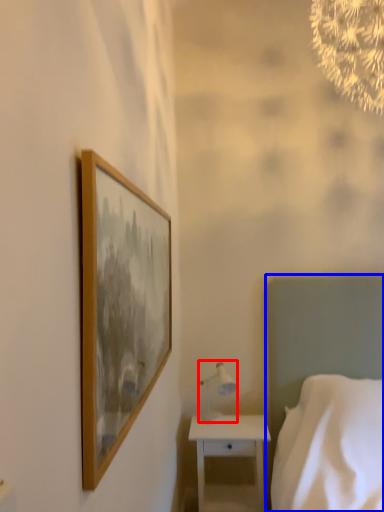
Question: Among these objects, which one is nearest to the camera, table lamp (highlighted by a red box) or bed (highlighted by a blue box)?

Choices:
 (A) table lamp
 (B) bed

Answer: (B)